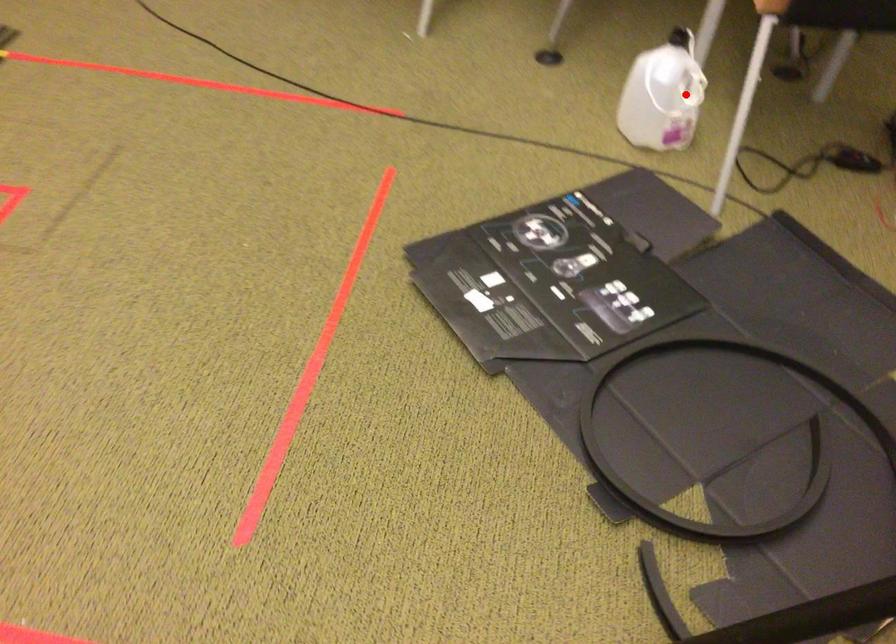
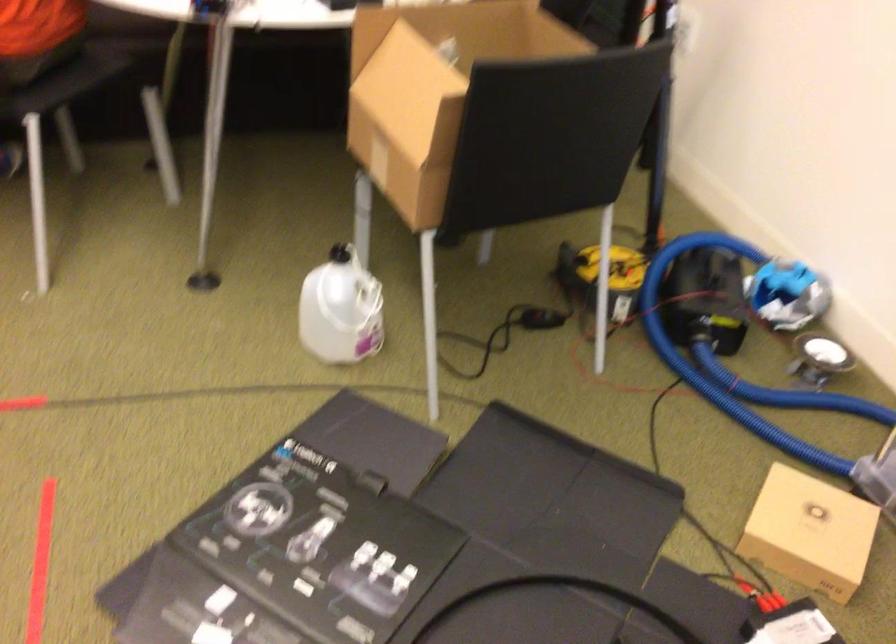
Locate, in the second image, the point that corresponds to the highlighted location in the first image.

(367, 305)